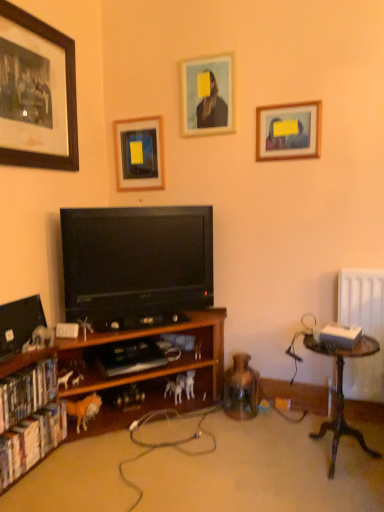
Where is `free location to the right of white matte horse at lower center, the third animal when ordered from front to back`? This screenshot has height=512, width=384. free location to the right of white matte horse at lower center, the third animal when ordered from front to back is located at coordinates [x=201, y=408].